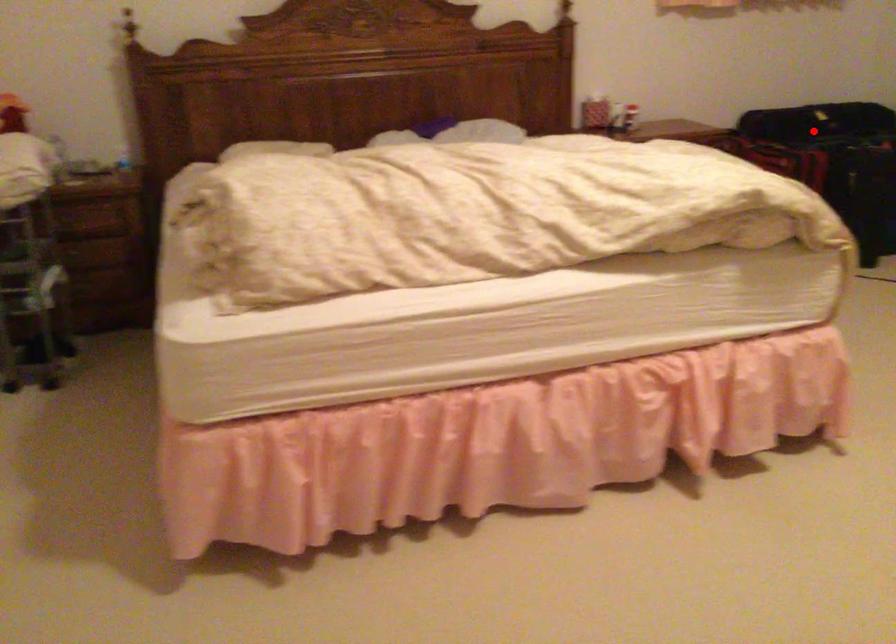
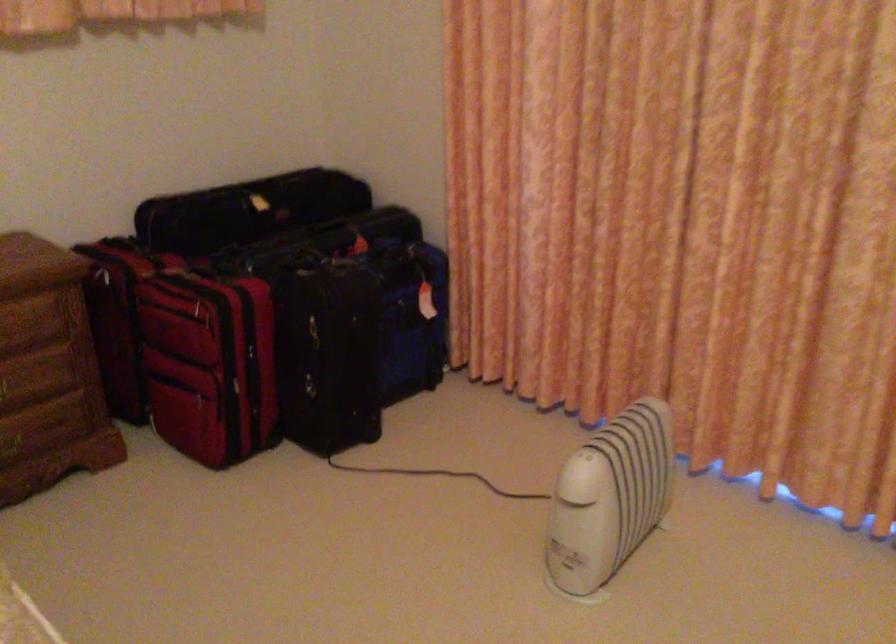
Locate, in the second image, the point that corresponds to the highlighted location in the first image.

(243, 292)